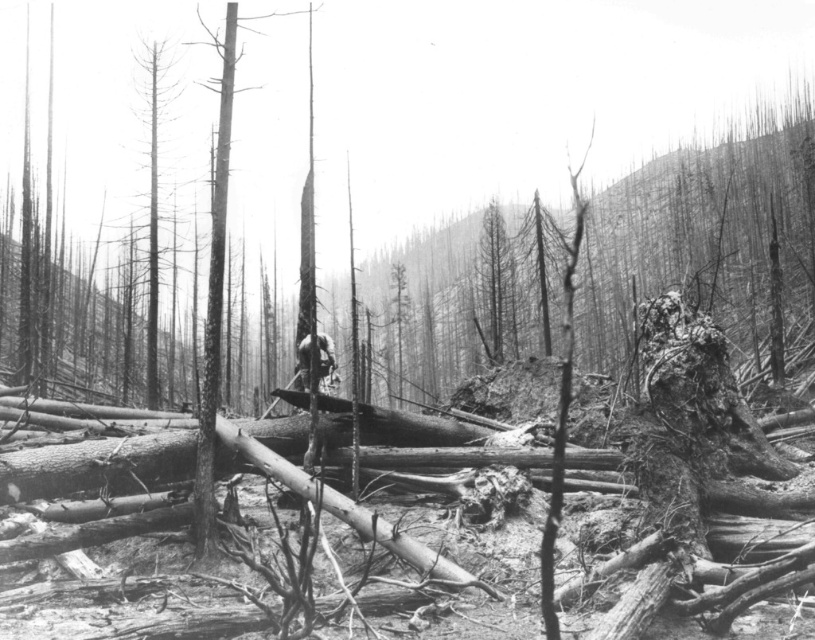
Is dead wood trunk at left positioned behind dark gray wood at center?

Yes, dead wood trunk at left is further from the viewer.

Locate an element on the screen. dead wood trunk at left is located at coordinates (153, 202).

The image size is (815, 640). What do you see at coordinates (494, 285) in the screenshot? I see `charred wood tree at center` at bounding box center [494, 285].

Does charred wood tree at center appear under dead wood trunk at left?

Indeed, charred wood tree at center is positioned under dead wood trunk at left.

Is point (492, 353) closer to viewer compared to point (153, 120)?

That is False.

Locate an element on the screen. charred wood tree at center is located at coordinates (494, 285).

Is point (509, 289) positioned in front of point (329, 365)?

No.

Who is more forward, (x=489, y=348) or (x=324, y=339)?

Positioned in front is point (x=324, y=339).

The image size is (815, 640). I want to click on charred wood tree at center, so click(x=494, y=285).

Where is `charred wood tree at center`? This screenshot has height=640, width=815. charred wood tree at center is located at coordinates (494, 285).